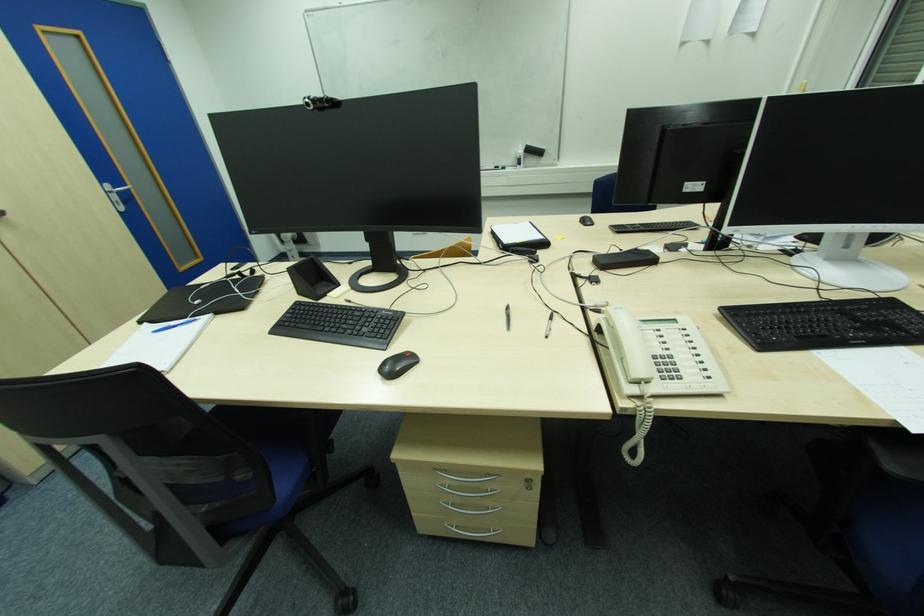
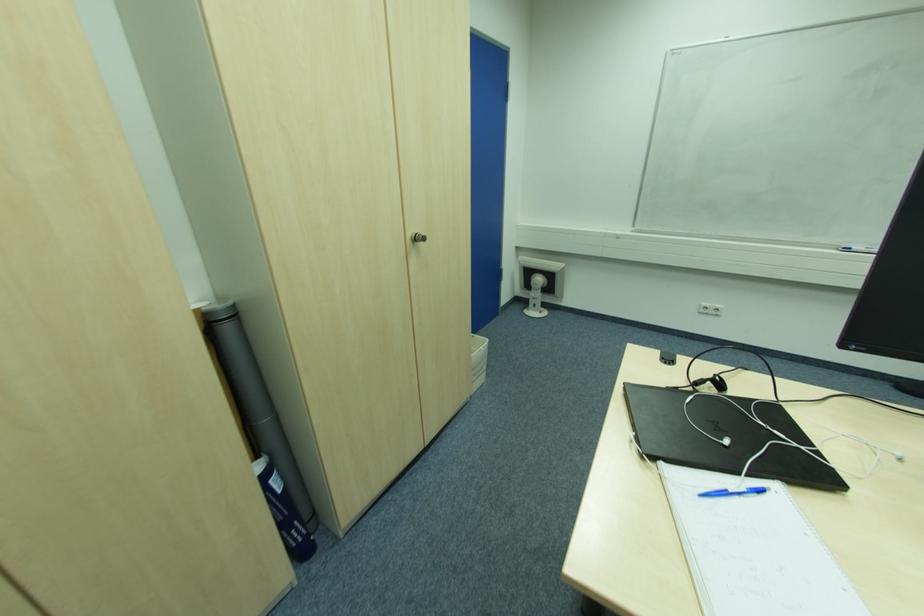
The point at (175, 328) is marked in the first image. Where is the corresponding point in the second image?

(727, 493)